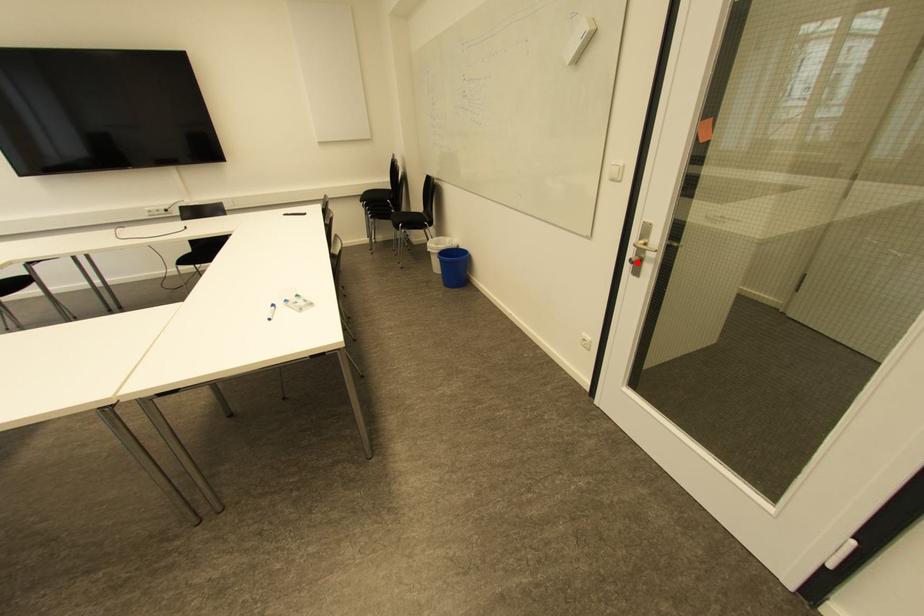
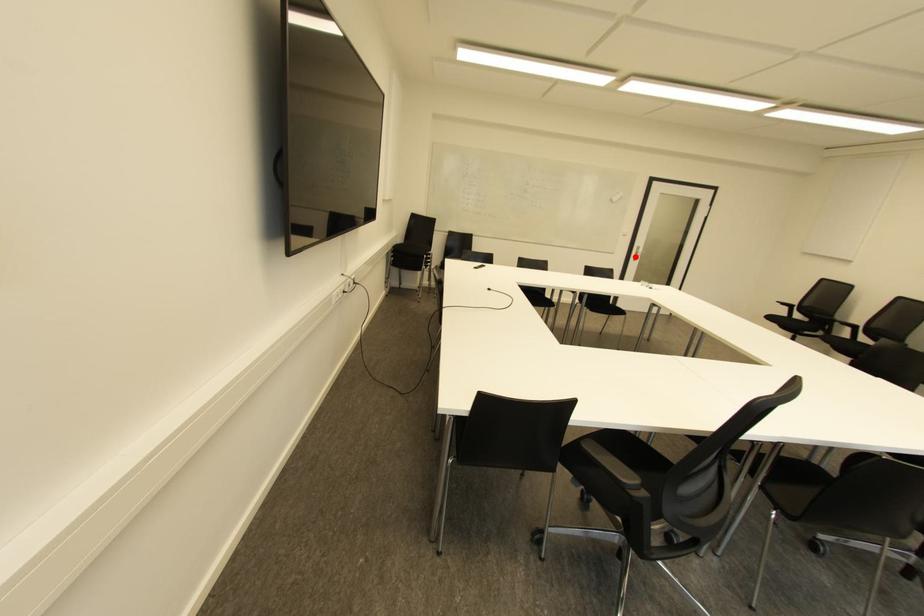
I am providing you with two images of the same scene from different viewpoints. A red point is marked on the first image and another point is marked on the second image. Is the red point in image1 aligned with the point shown in image2?

Yes